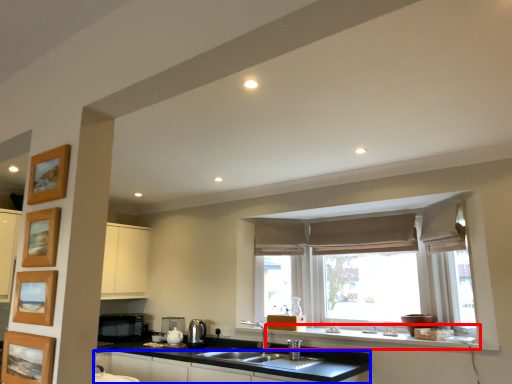
Question: Which object is closer to the camera taking this photo, window sill (highlighted by a red box) or cabinetry (highlighted by a blue box)?

Choices:
 (A) window sill
 (B) cabinetry

Answer: (B)